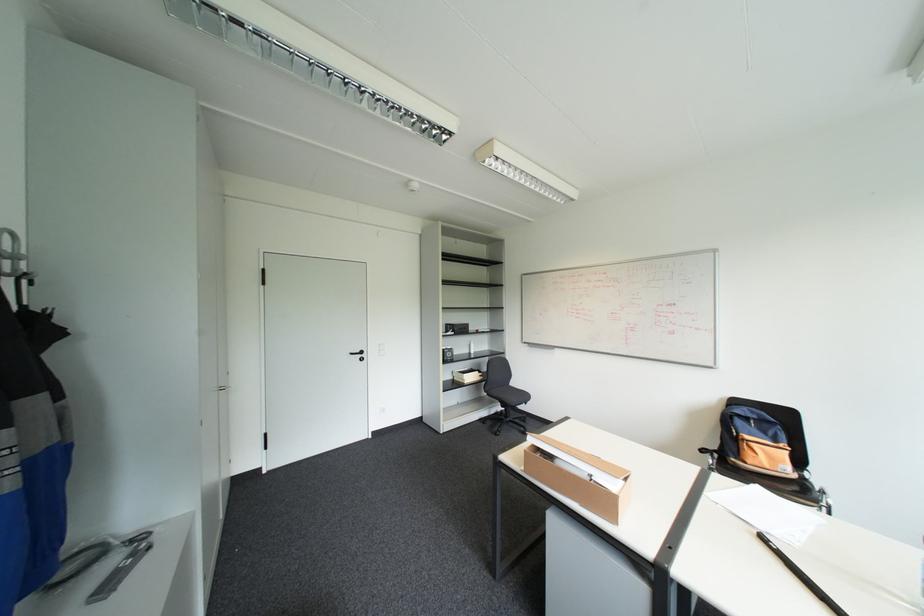
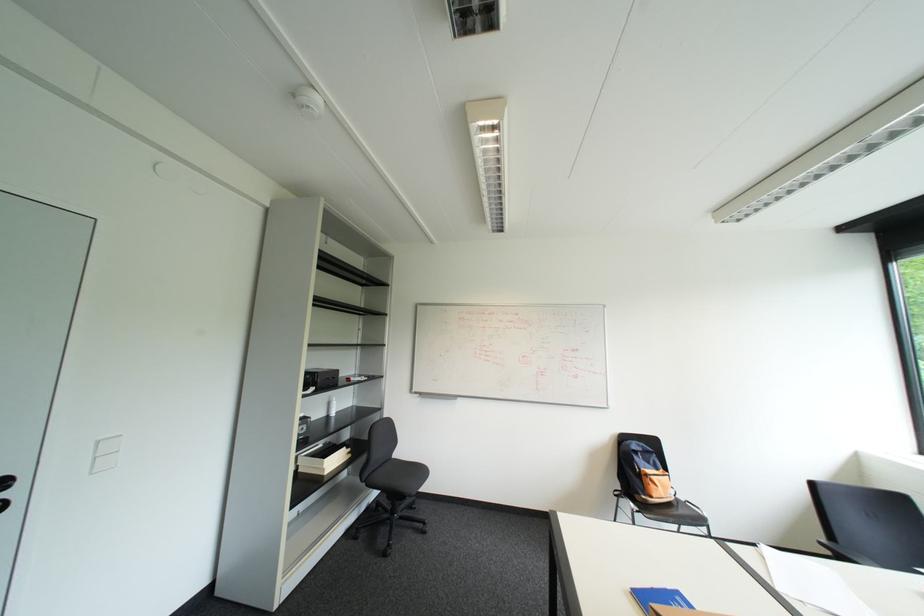
Locate, in the second image, the point that corresponds to point (387, 342) in the first image.

(107, 440)